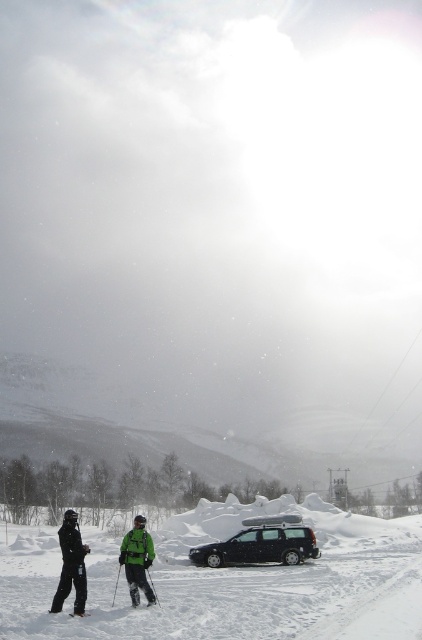
Which is above, black matte station wagon at center or black matte ski at lower center?

Positioned higher is black matte ski at lower center.

Does black matte station wagon at center have a lesser height compared to black matte ski at lower center?

No, black matte station wagon at center is not shorter than black matte ski at lower center.

Is point (292, 532) positioned after point (132, 600)?

That is True.

Locate an element on the screen. The width and height of the screenshot is (422, 640). black matte station wagon at center is located at coordinates [259, 547].

Can you confirm if black matte station wagon at center is taller than black matte ski suit at left?

Incorrect, black matte station wagon at center's height is not larger of black matte ski suit at left's.

Which of these two, black matte station wagon at center or black matte ski suit at left, stands shorter?

black matte station wagon at center

Who is more forward, (240, 548) or (67, 522)?

Point (67, 522)

Locate an element on the screen. This screenshot has width=422, height=640. black matte station wagon at center is located at coordinates (259, 547).

Is point (75, 522) more distant than point (86, 612)?

Yes.

Where is `black matte ski suit at left`? The image size is (422, 640). black matte ski suit at left is located at coordinates (70, 564).